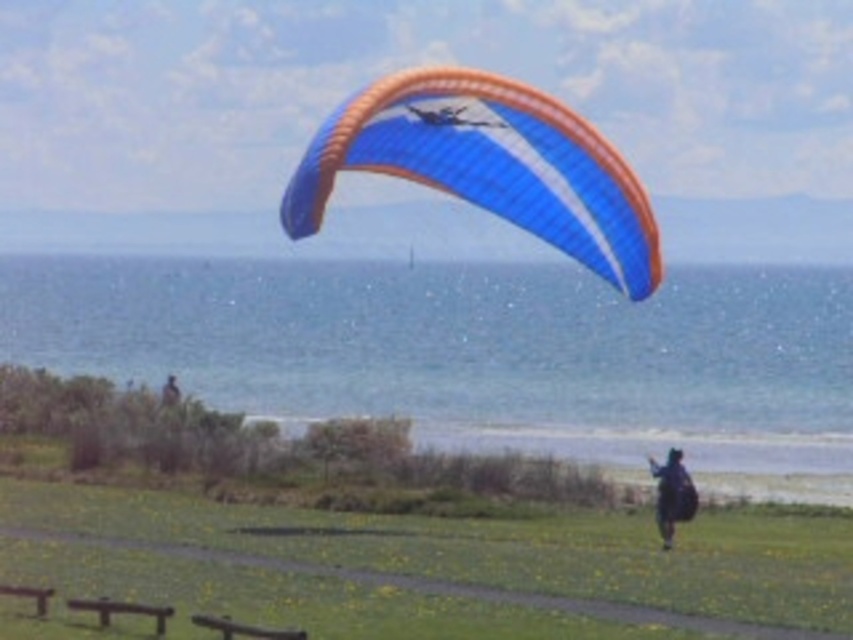
Question: Which of the following is the farthest from the observer?

Choices:
 (A) green grassy field at lower center
 (B) blue fabric parachute at upper center
 (C) dark blue fabric jacket at lower right
 (D) blue water at upper center

Answer: (C)

Question: Can you confirm if green grassy field at lower center is positioned below dark blue fabric jacket at lower right?

Choices:
 (A) yes
 (B) no

Answer: (A)

Question: Which point is closer to the camera?

Choices:
 (A) blue fabric parachute at upper center
 (B) green grassy field at lower center
 (C) dark blue fabric backpack at lower right
 (D) blue water at upper center

Answer: (B)

Question: Which object appears closest to the camera in this image?

Choices:
 (A) green grassy field at lower center
 (B) dark blue fabric jacket at lower right
 (C) dark blue fabric backpack at lower right
 (D) blue fabric parachute at upper center

Answer: (A)

Question: Is blue water at upper center bigger than green grassy field at lower center?

Choices:
 (A) yes
 (B) no

Answer: (A)

Question: Is blue water at upper center wider than dark blue fabric backpack at lower right?

Choices:
 (A) no
 (B) yes

Answer: (B)